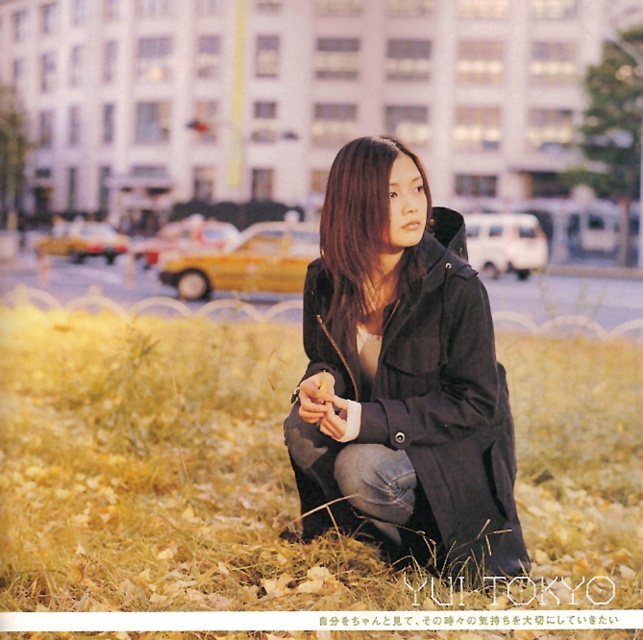
Question: Can you confirm if black matte jacket at center is positioned to the left of smooth black hair at center?

Choices:
 (A) yes
 (B) no

Answer: (B)

Question: Which point is farther to the camera?

Choices:
 (A) yellow dry grass at lower center
 (B) smooth black hair at center

Answer: (B)

Question: Which of these objects is positioned closest to the smooth black hair at center?

Choices:
 (A) yellow dry grass at lower center
 (B) black matte jacket at center

Answer: (B)

Question: Can you confirm if yellow dry grass at lower center is thinner than smooth black hair at center?

Choices:
 (A) yes
 (B) no

Answer: (B)

Question: Is yellow dry grass at lower center above black matte jacket at center?

Choices:
 (A) no
 (B) yes

Answer: (A)

Question: Which point is closer to the camera?

Choices:
 (A) (323, 209)
 (B) (248, 369)
 (C) (415, 211)

Answer: (C)